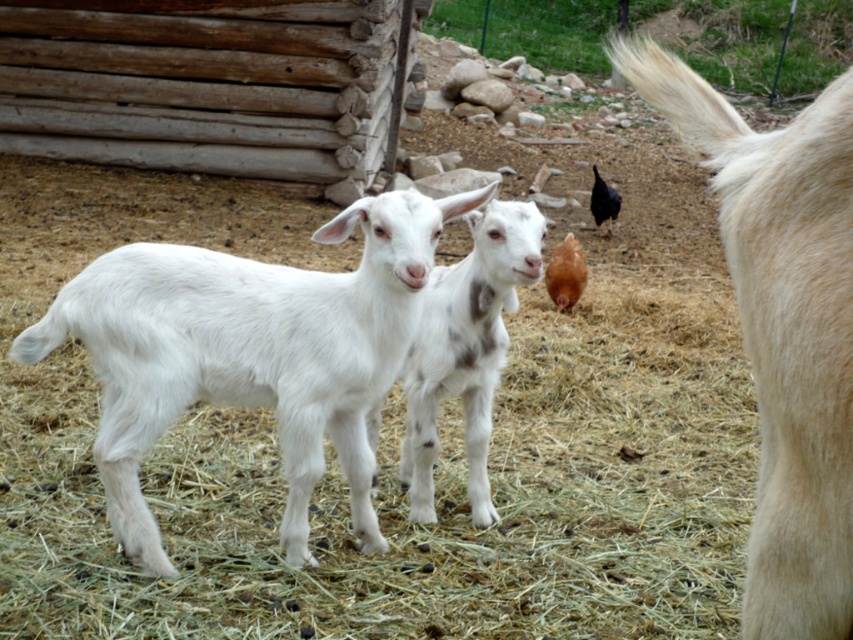
You are a farmer who needs to move the white woolen goat at center to a different area. The path to the new area is blocked by the white soft hay at center. Can you move the goat without moving the hay?

The white woolen goat at center is behind the white soft hay at center, so you can move the goat without moving the hay because the goat is already positioned behind the obstacle.

You are a farmer who wants to place a new feeding trough between the white soft hay at center and the white woolen goat at right. Based on their positions, which side of the hay should the trough be placed to ensure it is closer to the goat?

The white soft hay at center is to the left of the white woolen goat at right. To place the feeding trough closer to the goat, it should be positioned to the right of the white soft hay at center.